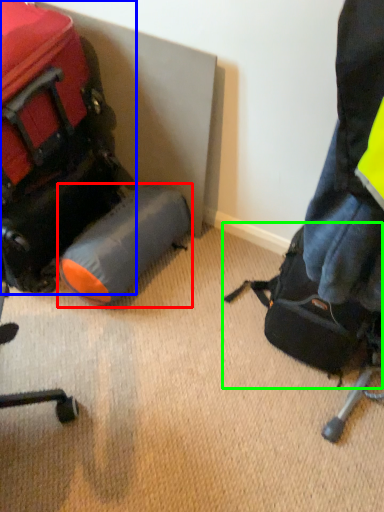
Question: Which is nearer to the luggage (highlighted by a red box)? luggage and bags (highlighted by a blue box) or luggage and bags (highlighted by a green box).

Choices:
 (A) luggage and bags
 (B) luggage and bags

Answer: (A)